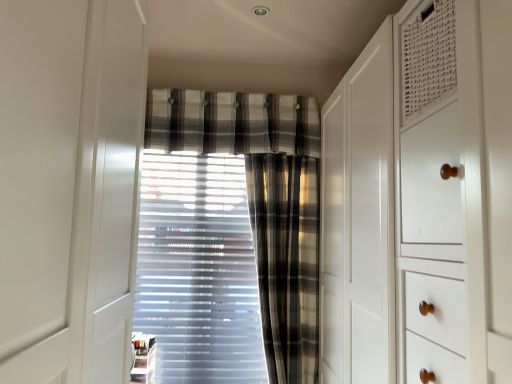
Question: Is plaid fabric at center behind plaid fabric curtain at center, which is the first curtain in left-to-right order?

Choices:
 (A) no
 (B) yes

Answer: (A)

Question: From a real-world perspective, does plaid fabric at center sit lower than plaid fabric curtain at center, which is the first curtain in left-to-right order?

Choices:
 (A) yes
 (B) no

Answer: (B)

Question: Does plaid fabric at center have a greater height compared to plaid fabric curtain at center, arranged as the 2th curtain when viewed from the right?

Choices:
 (A) no
 (B) yes

Answer: (A)

Question: From the image's perspective, is plaid fabric at center located beneath plaid fabric curtain at center, which is the first curtain in left-to-right order?

Choices:
 (A) yes
 (B) no

Answer: (B)

Question: From a real-world perspective, does plaid fabric at center stand above plaid fabric curtain at center, arranged as the 2th curtain when viewed from the right?

Choices:
 (A) no
 (B) yes

Answer: (B)

Question: Looking at their shapes, would you say plaid fabric curtain at center, positioned as the 2th curtain in left-to-right order, is wider or thinner than plaid fabric at center?

Choices:
 (A) wide
 (B) thin

Answer: (A)

Question: Relative to plaid fabric at center, is plaid fabric curtain at center, positioned as the 2th curtain in left-to-right order, in front or behind?

Choices:
 (A) behind
 (B) front

Answer: (B)

Question: Is plaid fabric curtain at center, positioned as the 2th curtain in left-to-right order, taller or shorter than plaid fabric at center?

Choices:
 (A) tall
 (B) short

Answer: (A)

Question: Visually, is plaid fabric curtain at center, positioned as the 2th curtain in left-to-right order, positioned to the left or to the right of plaid fabric at center?

Choices:
 (A) right
 (B) left

Answer: (A)

Question: In terms of size, does plaid fabric at center appear bigger or smaller than plaid fabric curtain at center, positioned as the 2th curtain in left-to-right order?

Choices:
 (A) big
 (B) small

Answer: (B)

Question: Do you think plaid fabric at center is within plaid fabric curtain at center, positioned as the 2th curtain in left-to-right order, or outside of it?

Choices:
 (A) outside
 (B) inside

Answer: (A)

Question: Looking at their shapes, would you say plaid fabric at center is wider or thinner than plaid fabric curtain at center, which is counted as the first curtain, starting from the right?

Choices:
 (A) thin
 (B) wide

Answer: (A)

Question: From the image's perspective, is plaid fabric at center above or below plaid fabric curtain at center, which is counted as the first curtain, starting from the right?

Choices:
 (A) below
 (B) above

Answer: (B)

Question: From the image's perspective, is plaid fabric at center above or below plaid fabric curtain at center, arranged as the 2th curtain when viewed from the right?

Choices:
 (A) below
 (B) above

Answer: (B)

Question: Which is correct: plaid fabric at center is inside plaid fabric curtain at center, arranged as the 2th curtain when viewed from the right, or outside of it?

Choices:
 (A) inside
 (B) outside

Answer: (B)